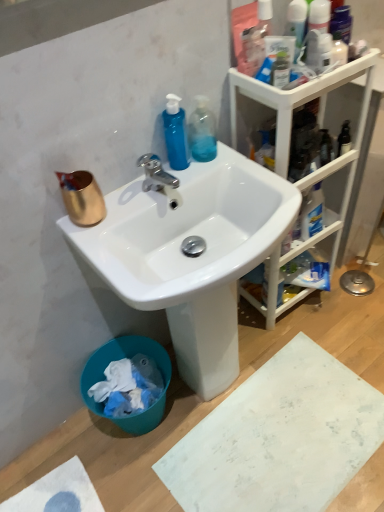
What are the coordinates of `vacant space to the left of chrome metallic faucet at upper center` in the screenshot? It's located at (120, 207).